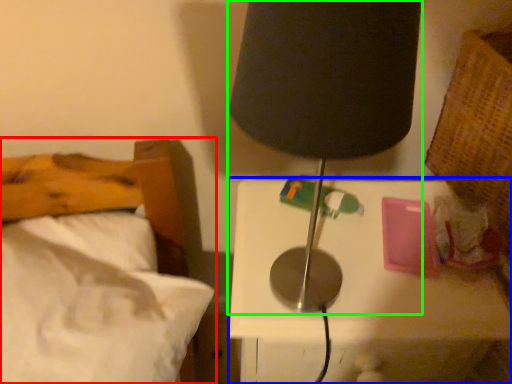
Question: Which object is positioned closest to bed (highlighted by a red box)? Select from nightstand (highlighted by a blue box) and lamp (highlighted by a green box).

Choices:
 (A) nightstand
 (B) lamp

Answer: (A)